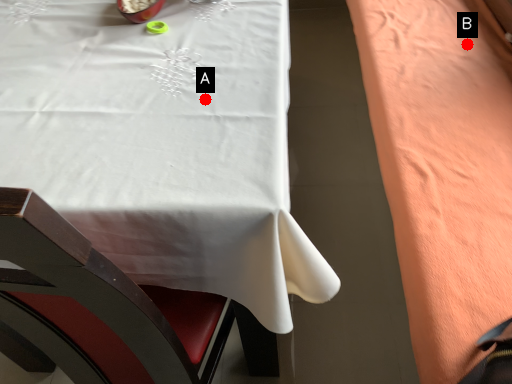
Question: Two points are circled on the image, labeled by A and B beside each circle. Which point appears farthest from the camera in this image?

Choices:
 (A) A is further
 (B) B is further

Answer: (B)